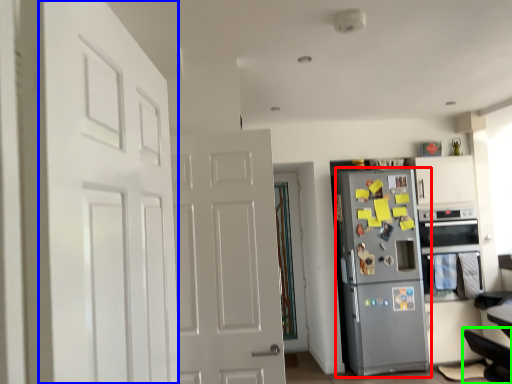
Question: Considering the real-world distances, which object is farthest from refrigerator (highlighted by a red box)? door (highlighted by a blue box) or swivel chair (highlighted by a green box)?

Choices:
 (A) door
 (B) swivel chair

Answer: (A)